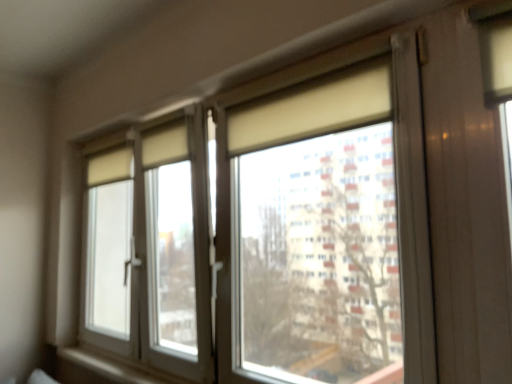
Question: In terms of width, does matte glass window at center look wider or thinner when compared to white matte window sill at lower left?

Choices:
 (A) wide
 (B) thin

Answer: (A)

Question: Is matte glass window at center to the left or to the right of white matte window sill at lower left in the image?

Choices:
 (A) left
 (B) right

Answer: (B)

Question: Is matte glass window at center taller or shorter than white matte window sill at lower left?

Choices:
 (A) short
 (B) tall

Answer: (B)

Question: Would you say white matte window sill at lower left is inside or outside matte glass window at center?

Choices:
 (A) outside
 (B) inside

Answer: (B)

Question: From a real-world perspective, relative to matte glass window at center, is white matte window sill at lower left vertically above or below?

Choices:
 (A) below
 (B) above

Answer: (A)

Question: In terms of width, does white matte window sill at lower left look wider or thinner when compared to matte glass window at center?

Choices:
 (A) wide
 (B) thin

Answer: (B)

Question: Relative to matte glass window at center, is white matte window sill at lower left in front or behind?

Choices:
 (A) behind
 (B) front

Answer: (A)